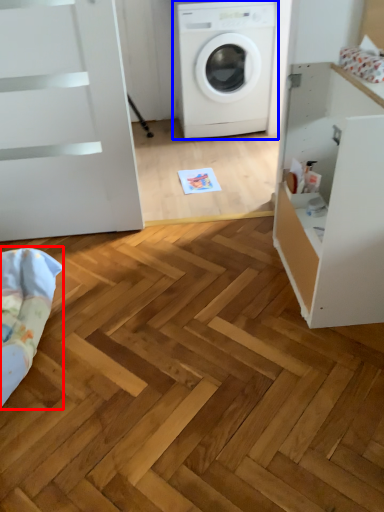
Question: Which of the following is the closest to the observer, bedding (highlighted by a red box) or washing machine (highlighted by a blue box)?

Choices:
 (A) bedding
 (B) washing machine

Answer: (A)